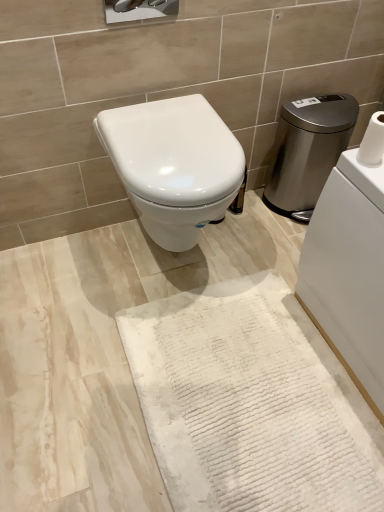
Question: In terms of size, does stainless steel water heater at right appear bigger or smaller than white glossy toilet at center?

Choices:
 (A) big
 (B) small

Answer: (B)

Question: Which is correct: stainless steel water heater at right is inside white glossy toilet at center, or outside of it?

Choices:
 (A) inside
 (B) outside

Answer: (B)

Question: Which is nearer to the stainless steel water heater at right?

Choices:
 (A) white textured bath mat at center
 (B) white textured toilet paper at upper right
 (C) white glossy toilet at center

Answer: (C)

Question: Which of these objects is positioned closest to the white textured toilet paper at upper right?

Choices:
 (A) stainless steel water heater at right
 (B) white glossy toilet at center
 (C) white textured bath mat at center

Answer: (B)